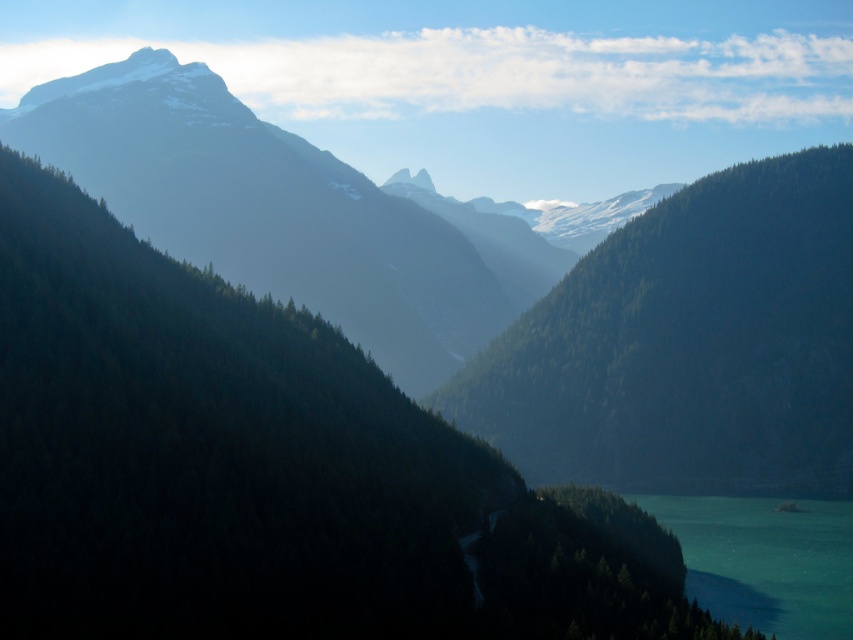
You are standing at the point marked by the coordinate point at point (509,284) in the image. Looking around, you see the green forested mountain range at center. Which direction should you face to see the green forested mountain range at center?

You are already at the point representing the green forested mountain range at center, so facing any direction would allow you to see the mountain range around you.

You are a hiker planning to cross the valley. You see the green forested mountain range at center and the teal glossy water at lower right. Which of these two landmarks is larger in size?

The green forested mountain range at center is bigger than the teal glossy water at lower right, so the mountain range is larger in size.

You are a hiker planning to cross the valley. You see the green textured forest at center and the teal glossy water at lower right. Which one is higher in elevation?

The green textured forest at center is taller than the teal glossy water at lower right, so the green textured forest at center is higher in elevation.